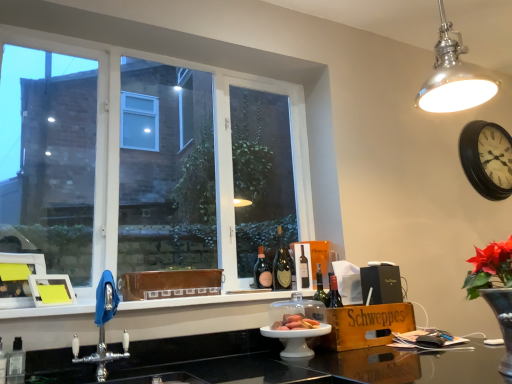
Question: Does chrome metallic tap at lower left appear on the right side of polished metal light fixture at upper right?

Choices:
 (A) yes
 (B) no

Answer: (B)

Question: Is chrome metallic tap at lower left bigger than polished metal light fixture at upper right?

Choices:
 (A) yes
 (B) no

Answer: (B)

Question: From a real-world perspective, is chrome metallic tap at lower left over polished metal light fixture at upper right?

Choices:
 (A) yes
 (B) no

Answer: (B)

Question: Would you say chrome metallic tap at lower left is outside polished metal light fixture at upper right?

Choices:
 (A) no
 (B) yes

Answer: (B)

Question: Does chrome metallic tap at lower left turn towards polished metal light fixture at upper right?

Choices:
 (A) yes
 (B) no

Answer: (B)

Question: Is point (303, 327) closer or farther from the camera than point (408, 302)?

Choices:
 (A) closer
 (B) farther

Answer: (A)

Question: In the image, is matte brown bread at center positioned in front of or behind wooden box at lower right?

Choices:
 (A) front
 (B) behind

Answer: (A)

Question: Looking at the image, does matte brown bread at center seem bigger or smaller compared to wooden box at lower right?

Choices:
 (A) small
 (B) big

Answer: (A)

Question: Based on their positions, is matte brown bread at center located to the left or right of wooden box at lower right?

Choices:
 (A) right
 (B) left

Answer: (B)

Question: From the image's perspective, is matte glass bottle at center, the 2th bottle positioned from the right, above or below white glossy window sill at lower center?

Choices:
 (A) below
 (B) above

Answer: (B)

Question: Looking at the image, does matte glass bottle at center, the 1th bottle in the left-to-right sequence, seem bigger or smaller compared to white glossy window sill at lower center?

Choices:
 (A) small
 (B) big

Answer: (A)

Question: Is matte glass bottle at center, the 2th bottle positioned from the right, in front of or behind white glossy window sill at lower center in the image?

Choices:
 (A) front
 (B) behind

Answer: (B)

Question: Looking at their shapes, would you say matte glass bottle at center, the 1th bottle in the left-to-right sequence, is wider or thinner than white glossy window sill at lower center?

Choices:
 (A) wide
 (B) thin

Answer: (B)

Question: Considering their positions, is black wooden clock at upper right located in front of or behind shiny gold bottle at center, the 1th bottle when ordered from right to left?

Choices:
 (A) front
 (B) behind

Answer: (B)

Question: In terms of size, does black wooden clock at upper right appear bigger or smaller than shiny gold bottle at center, the 1th bottle when ordered from right to left?

Choices:
 (A) small
 (B) big

Answer: (B)